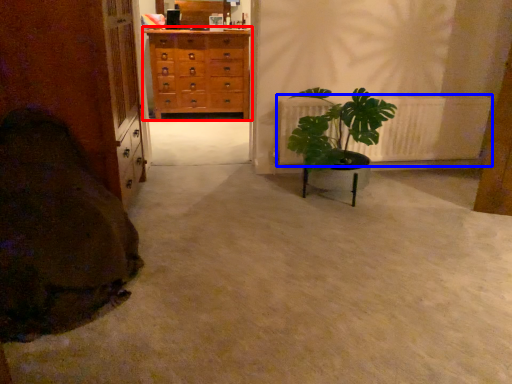
Question: Which object is closer to the camera taking this photo, chest of drawers (highlighted by a red box) or radiator (highlighted by a blue box)?

Choices:
 (A) chest of drawers
 (B) radiator

Answer: (B)